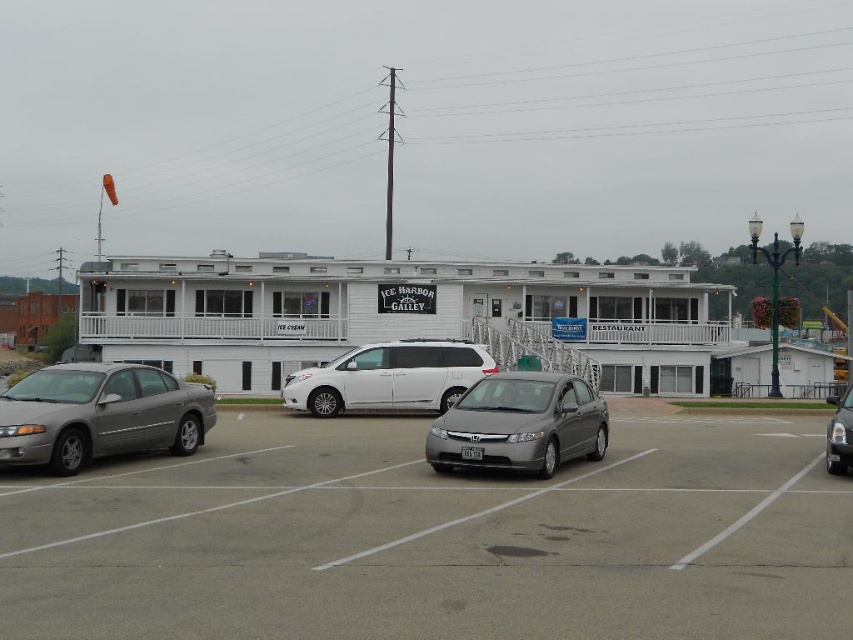
Can you confirm if gray metallic car at center is thinner than shiny black sedan at right?

Yes.

Describe the element at coordinates (437, 540) in the screenshot. I see `gray metallic car at center` at that location.

Locate an element on the screen. Image resolution: width=853 pixels, height=640 pixels. gray metallic car at center is located at coordinates (437, 540).

Is point (164, 436) in front of point (840, 412)?

No, it is behind (840, 412).

Who is positioned more to the left, silver metallic sedan at left or shiny black sedan at right?

silver metallic sedan at left

Where is `silver metallic sedan at left`? The height and width of the screenshot is (640, 853). silver metallic sedan at left is located at coordinates (99, 413).

Is white matte van at center wider than shiny black sedan at right?

No.

Who is positioned more to the right, white matte van at center or shiny black sedan at right?

Positioned to the right is shiny black sedan at right.

The image size is (853, 640). I want to click on white matte van at center, so click(389, 376).